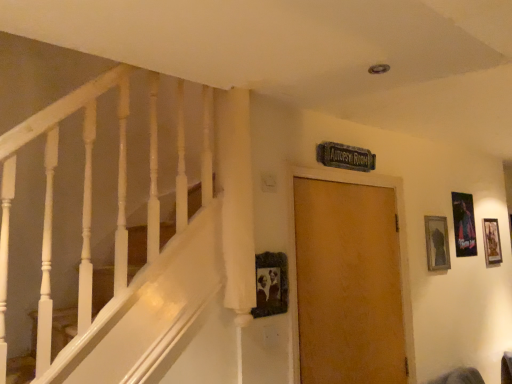
Question: Is wooden door at center not near matte black picture frame at upper right, marked as the 3th picture frame in a right-to-left arrangement?

Choices:
 (A) yes
 (B) no

Answer: (B)

Question: Considering the relative positions of wooden door at center and matte black picture frame at upper right, marked as the 3th picture frame in a right-to-left arrangement, in the image provided, is wooden door at center to the right of matte black picture frame at upper right, marked as the 3th picture frame in a right-to-left arrangement, from the viewer's perspective?

Choices:
 (A) no
 (B) yes

Answer: (A)

Question: Considering the relative sizes of wooden door at center and matte black picture frame at upper right, the third picture frame viewed from the back, in the image provided, is wooden door at center smaller than matte black picture frame at upper right, the third picture frame viewed from the back,?

Choices:
 (A) yes
 (B) no

Answer: (B)

Question: Is matte black picture frame at upper right, the second picture frame in the front-to-back sequence, completely or partially inside wooden door at center?

Choices:
 (A) no
 (B) yes

Answer: (A)

Question: Does wooden door at center turn towards matte black picture frame at upper right, the second picture frame in the front-to-back sequence?

Choices:
 (A) no
 (B) yes

Answer: (A)

Question: Is wooden door at center positioned with its back to matte black picture frame at upper right, which is counted as the 2th picture frame, starting from the left?

Choices:
 (A) no
 (B) yes

Answer: (A)

Question: Could you tell me if matte black picture frame at upper right, the second picture frame in the front-to-back sequence, is turned towards wooden photo frame at center, acting as the 1th picture frame starting from the front?

Choices:
 (A) no
 (B) yes

Answer: (A)

Question: Is matte black picture frame at upper right, the second picture frame in the front-to-back sequence, looking in the opposite direction of wooden photo frame at center, arranged as the fourth picture frame when viewed from the right?

Choices:
 (A) yes
 (B) no

Answer: (B)

Question: Does matte black picture frame at upper right, which is counted as the 2th picture frame, starting from the left, have a lesser height compared to wooden photo frame at center, positioned as the fourth picture frame in back-to-front order?

Choices:
 (A) no
 (B) yes

Answer: (A)

Question: Does matte black picture frame at upper right, the third picture frame viewed from the back, lie in front of wooden photo frame at center, arranged as the fourth picture frame when viewed from the right?

Choices:
 (A) no
 (B) yes

Answer: (A)

Question: Does matte black picture frame at upper right, marked as the 3th picture frame in a right-to-left arrangement, lie behind wooden photo frame at center, acting as the 1th picture frame starting from the front?

Choices:
 (A) no
 (B) yes

Answer: (B)

Question: Would you say matte black picture frame at upper right, which is counted as the 2th picture frame, starting from the left, contains wooden photo frame at center, placed as the 1th picture frame when sorted from left to right?

Choices:
 (A) no
 (B) yes

Answer: (A)

Question: Is the depth of metallic silver poster at right, the 2th picture frame from the back, less than that of matte black picture frame at upper right, the second picture frame in the front-to-back sequence?

Choices:
 (A) no
 (B) yes

Answer: (A)